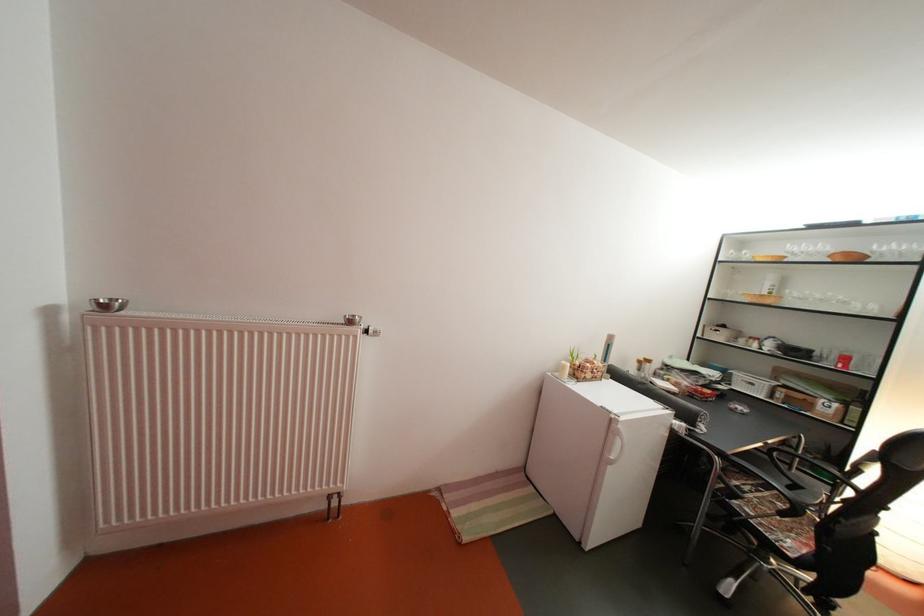
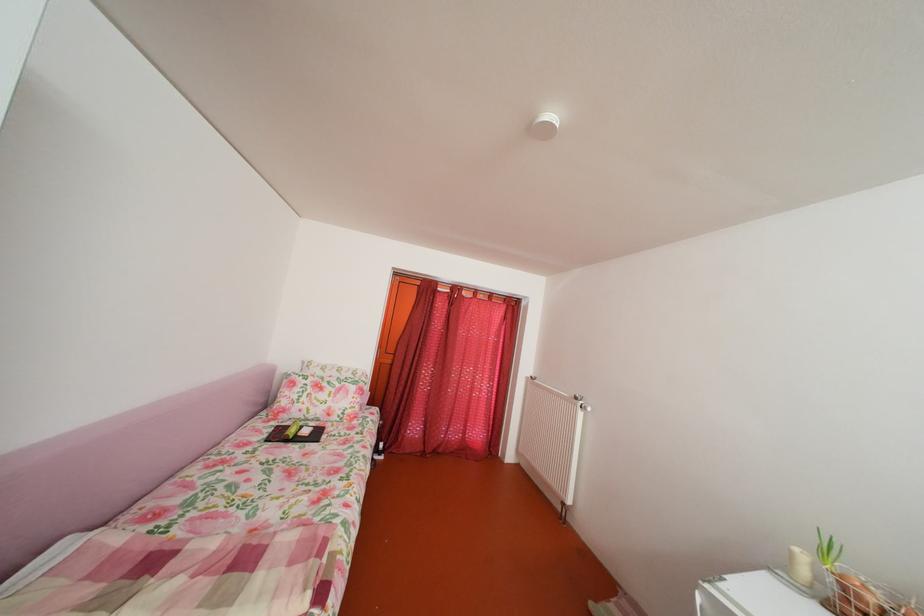
The point at (x=361, y=329) is marked in the first image. Where is the corresponding point in the second image?

(588, 405)